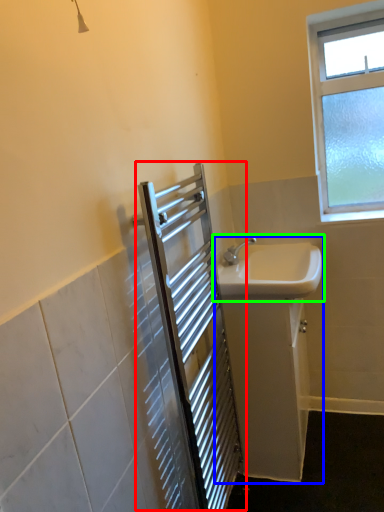
Question: Which object is the farthest from screen door (highlighted by a red box)? Choose among these: sink (highlighted by a blue box) or sink (highlighted by a green box).

Choices:
 (A) sink
 (B) sink

Answer: (B)